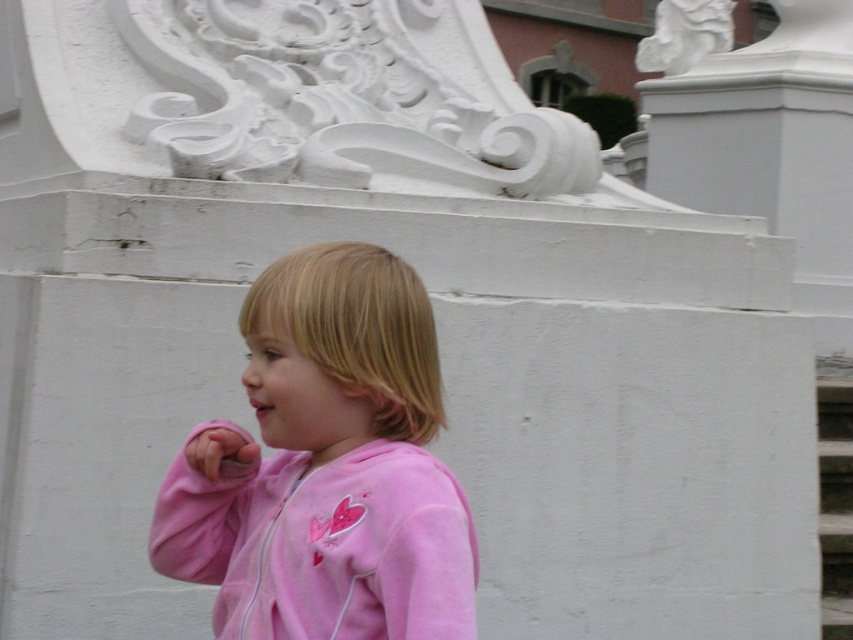
Question: Which point appears farthest from the camera in this image?

Choices:
 (A) (844, 515)
 (B) (291, 632)

Answer: (A)

Question: Does pink fleece jacket at center appear on the left side of white textured stair at lower right?

Choices:
 (A) yes
 (B) no

Answer: (A)

Question: Can you confirm if pink fleece jacket at center is wider than white textured stair at lower right?

Choices:
 (A) no
 (B) yes

Answer: (B)

Question: Does pink fleece jacket at center appear on the right side of white textured stair at lower right?

Choices:
 (A) no
 (B) yes

Answer: (A)